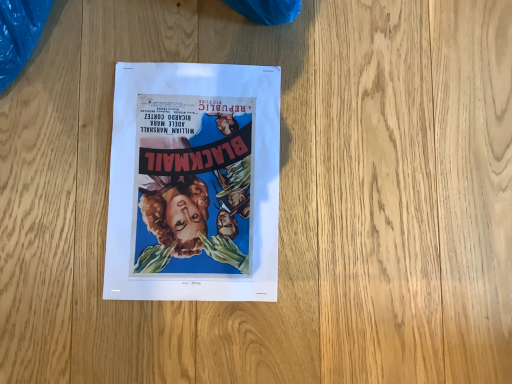
What do you see at coordinates (194, 183) in the screenshot? This screenshot has width=512, height=384. I see `matte paper poster at center` at bounding box center [194, 183].

The width and height of the screenshot is (512, 384). In order to click on matte paper poster at center in this screenshot , I will do `click(194, 183)`.

Identify the location of matte paper poster at center. Image resolution: width=512 pixels, height=384 pixels. (194, 183).